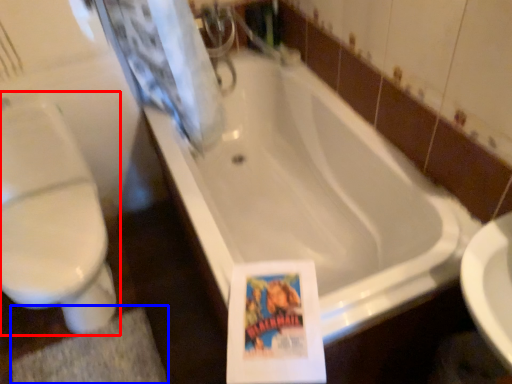
Question: Which object appears closest to the camera in this image, toilet (highlighted by a red box) or bath mat (highlighted by a blue box)?

Choices:
 (A) toilet
 (B) bath mat

Answer: (A)